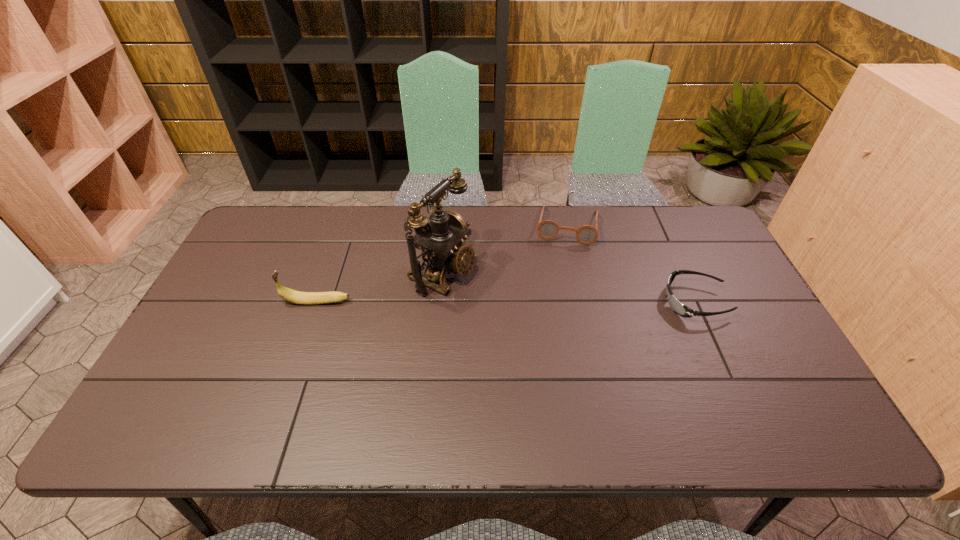
Locate an element on the screen. The width and height of the screenshot is (960, 540). blank region between the third shortest object and the third object from right to left is located at coordinates (380, 287).

Where is `unoccupied area between the sunglasses and the second tallest object`? unoccupied area between the sunglasses and the second tallest object is located at coordinates (506, 302).

Locate an element on the screen. The image size is (960, 540). free space between the telephone and the leftmost object is located at coordinates (380, 287).

At what (x,y) coordinates should I click in order to perform the action: click on the second closest object to the second object from left to right. Please return your answer as a coordinate pair (x, y). The image size is (960, 540). Looking at the image, I should click on (547, 229).

Identify the location of the second closest object to the third object from right to left. (547, 229).

Image resolution: width=960 pixels, height=540 pixels. I want to click on vacant space that satisfies the following two spatial constraints: 1. on the back side of the tallest object; 2. on the right side of the spectacles, so (x=447, y=225).

Where is `vacant region that satisfies the following two spatial constraints: 1. on the front side of the third tallest object; 2. on the lenses of the rightmost object`? vacant region that satisfies the following two spatial constraints: 1. on the front side of the third tallest object; 2. on the lenses of the rightmost object is located at coordinates (584, 302).